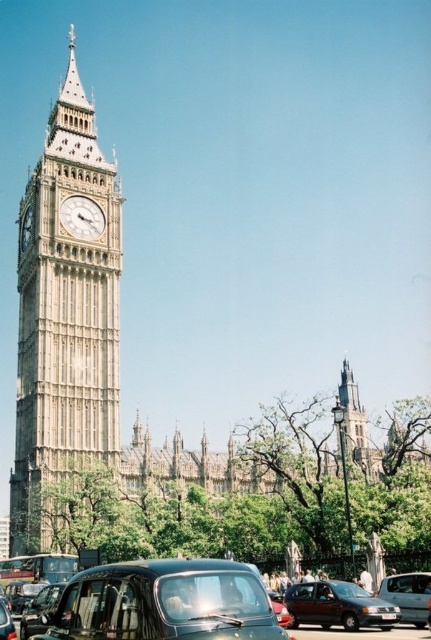
You are a tourist visiting London and want to take a photo of both the stone clock tower at left and the black rubber car at lower center in the same frame. Given their sizes, which object should you position closer to the camera to ensure both fit well in the photo?

The stone clock tower at left is bigger than the black rubber car at lower center. To ensure both fit well in the photo, position the stone clock tower at left closer to the camera since it is larger, allowing the black rubber car at lower center to be captured in the same frame without being too small.

You are a tourist standing at the center of the street in front of the black rubber car at lower center. Which direction should you walk to reach the stone clock tower at left?

The stone clock tower at left is to the left of the black rubber car at lower center, so you should walk to the left to reach it.